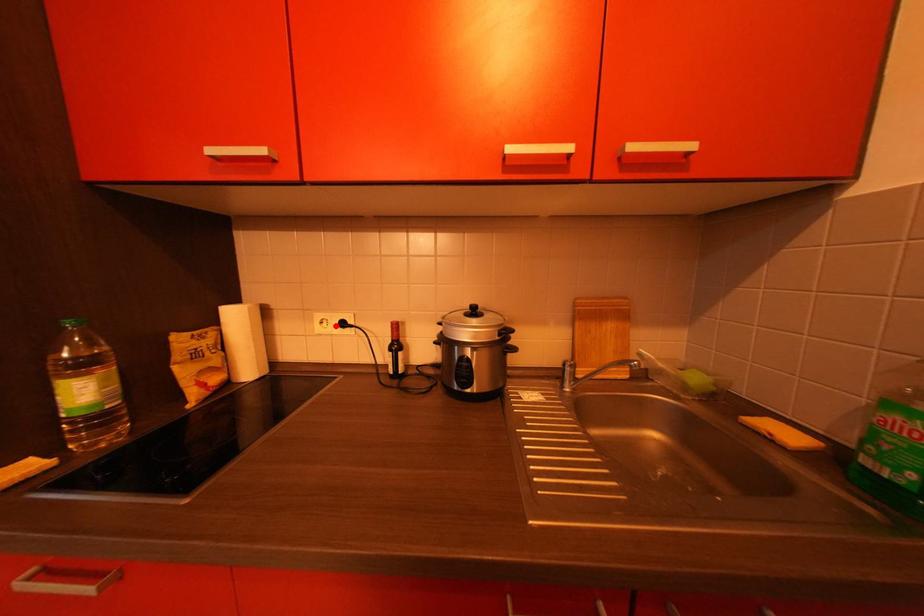
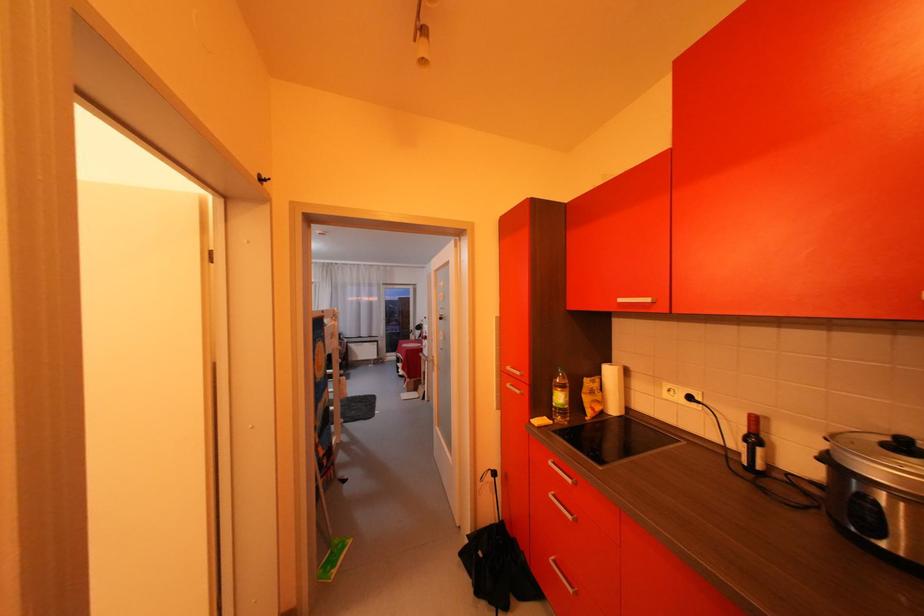
Locate, in the second image, the point that corresponds to the highlighted location in the first image.

(684, 394)